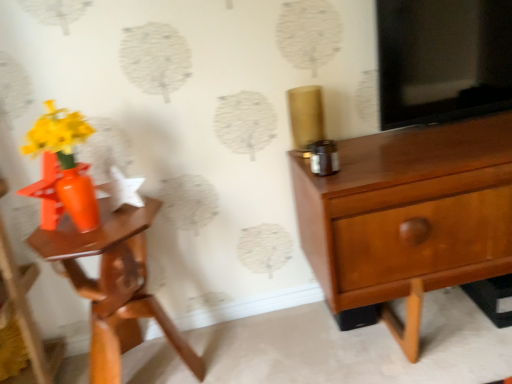
Question: Considering the positions of matte wood chest of drawers at right and matte orange nightstand at left in the image, is matte wood chest of drawers at right taller or shorter than matte orange nightstand at left?

Choices:
 (A) tall
 (B) short

Answer: (A)

Question: In the image, is matte wood chest of drawers at right on the left side or the right side of matte orange nightstand at left?

Choices:
 (A) left
 (B) right

Answer: (B)

Question: Estimate the real-world distances between objects in this image. Which object is farther from the matte orange nightstand at left?

Choices:
 (A) orange glossy vase at left
 (B) matte wood chest of drawers at right

Answer: (B)

Question: Considering the real-world distances, which object is closest to the matte wood chest of drawers at right?

Choices:
 (A) orange glossy vase at left
 (B) matte orange nightstand at left

Answer: (B)